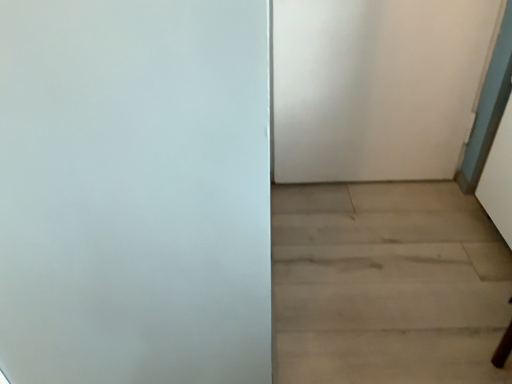
Question: Is white matte door at upper right completely or partially outside of light wood floor at lower right?

Choices:
 (A) yes
 (B) no

Answer: (A)

Question: From the image's perspective, is white matte door at upper right under light wood floor at lower right?

Choices:
 (A) no
 (B) yes

Answer: (A)

Question: From a real-world perspective, does white matte door at upper right stand above light wood floor at lower right?

Choices:
 (A) no
 (B) yes

Answer: (B)

Question: Is white matte door at upper right oriented towards light wood floor at lower right?

Choices:
 (A) yes
 (B) no

Answer: (A)

Question: Are white matte door at upper right and light wood floor at lower right making contact?

Choices:
 (A) yes
 (B) no

Answer: (B)

Question: From a real-world perspective, is white matte door at upper right below light wood floor at lower right?

Choices:
 (A) no
 (B) yes

Answer: (A)

Question: From the image's perspective, is light wood floor at lower right beneath white matte door at upper right?

Choices:
 (A) yes
 (B) no

Answer: (A)

Question: Can you confirm if light wood floor at lower right is thinner than white matte door at upper right?

Choices:
 (A) yes
 (B) no

Answer: (B)

Question: Is light wood floor at lower right placed right next to white matte door at upper right?

Choices:
 (A) yes
 (B) no

Answer: (B)

Question: Is light wood floor at lower right looking in the opposite direction of white matte door at upper right?

Choices:
 (A) no
 (B) yes

Answer: (A)

Question: Can you confirm if light wood floor at lower right is smaller than white matte door at upper right?

Choices:
 (A) no
 (B) yes

Answer: (B)

Question: Is light wood floor at lower right not close to white matte door at upper right?

Choices:
 (A) yes
 (B) no

Answer: (B)

Question: From the image's perspective, relative to light wood floor at lower right, is white matte door at upper right above or below?

Choices:
 (A) above
 (B) below

Answer: (A)